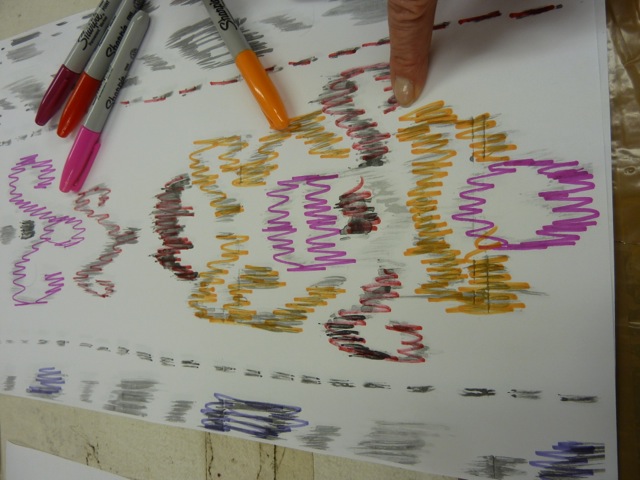
I want to click on tabletop, so click(628, 171).